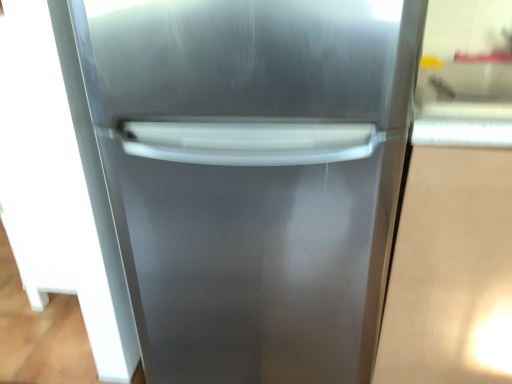
Question: Can you confirm if polished silver refrigerator door at left is taller than stainless steel refrigerator at center?

Choices:
 (A) yes
 (B) no

Answer: (B)

Question: Is polished silver refrigerator door at left turned away from stainless steel refrigerator at center?

Choices:
 (A) yes
 (B) no

Answer: (A)

Question: Could you tell me if polished silver refrigerator door at left is facing stainless steel refrigerator at center?

Choices:
 (A) no
 (B) yes

Answer: (A)

Question: Is polished silver refrigerator door at left closer to the viewer compared to stainless steel refrigerator at center?

Choices:
 (A) yes
 (B) no

Answer: (B)

Question: Is polished silver refrigerator door at left not within stainless steel refrigerator at center?

Choices:
 (A) no
 (B) yes

Answer: (B)

Question: Is polished silver refrigerator door at left to the right of stainless steel refrigerator at center from the viewer's perspective?

Choices:
 (A) yes
 (B) no

Answer: (B)

Question: Can you confirm if stainless steel refrigerator at center is smaller than polished silver refrigerator door at left?

Choices:
 (A) yes
 (B) no

Answer: (B)

Question: Is stainless steel refrigerator at center oriented towards polished silver refrigerator door at left?

Choices:
 (A) no
 (B) yes

Answer: (A)

Question: Can you confirm if stainless steel refrigerator at center is wider than polished silver refrigerator door at left?

Choices:
 (A) yes
 (B) no

Answer: (A)

Question: Can you confirm if stainless steel refrigerator at center is shorter than polished silver refrigerator door at left?

Choices:
 (A) yes
 (B) no

Answer: (B)

Question: Is the position of stainless steel refrigerator at center more distant than that of polished silver refrigerator door at left?

Choices:
 (A) yes
 (B) no

Answer: (B)

Question: Is stainless steel refrigerator at center positioned with its back to polished silver refrigerator door at left?

Choices:
 (A) no
 (B) yes

Answer: (A)

Question: Would you say stainless steel refrigerator at center is to the left or to the right of polished silver refrigerator door at left in the picture?

Choices:
 (A) right
 (B) left

Answer: (A)